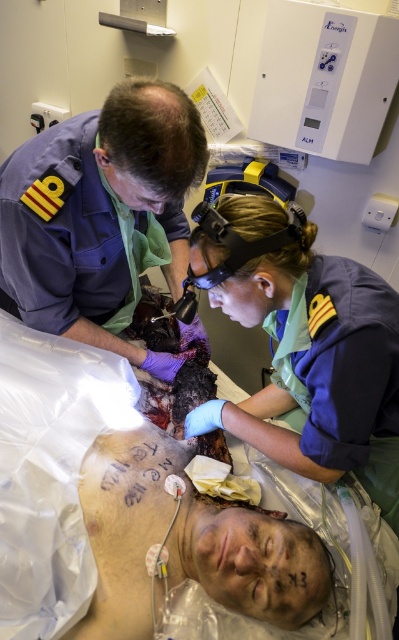
Question: Which point is farther to the camera?

Choices:
 (A) blue uniform at center
 (B) purple uniform at upper left

Answer: (A)

Question: Where is blue uniform at center located in relation to purple uniform at upper left in the image?

Choices:
 (A) below
 (B) above

Answer: (A)

Question: Where is blue uniform at center located in relation to purple uniform at upper left in the image?

Choices:
 (A) below
 (B) above

Answer: (A)

Question: Does blue uniform at center come behind purple uniform at upper left?

Choices:
 (A) yes
 (B) no

Answer: (A)